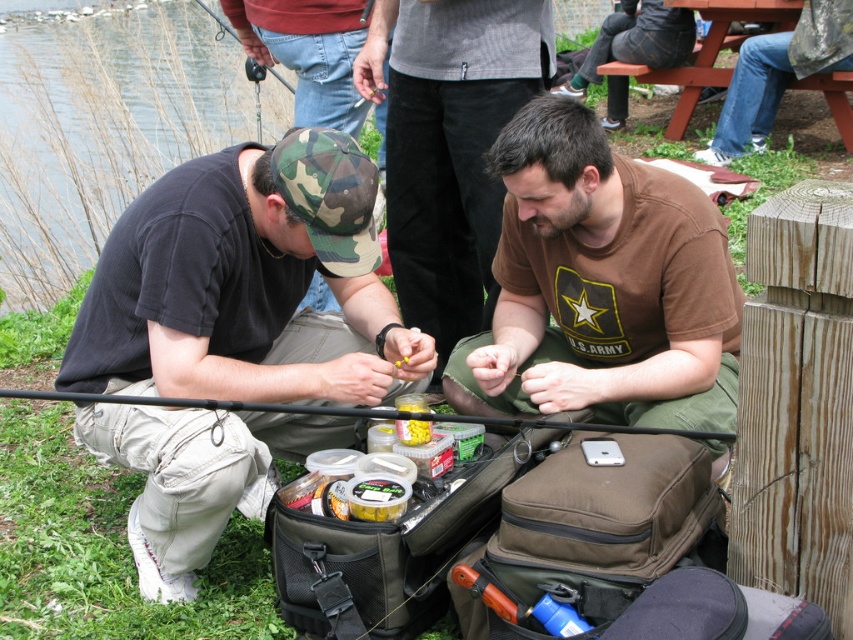
Between dark blue t-shirt at lower left and black matte fishing pole at center, which one is positioned lower?

black matte fishing pole at center is lower down.

Based on the photo, who is more forward, (131, 275) or (366, 416)?

Point (366, 416)

The width and height of the screenshot is (853, 640). Find the location of `dark blue t-shirt at lower left`. dark blue t-shirt at lower left is located at coordinates (247, 284).

What do you see at coordinates (360, 413) in the screenshot? I see `black matte fishing pole at center` at bounding box center [360, 413].

Who is more distant from viewer, (705, 433) or (428, 422)?

Point (428, 422)

Between point (524, 426) and point (430, 433), which one is positioned in front?

Point (524, 426) is in front.

Locate an element on the screen. The width and height of the screenshot is (853, 640). black matte fishing pole at center is located at coordinates (360, 413).

Does brown cotton shirt at center have a smaller size compared to black matte fishing pole at center?

No, brown cotton shirt at center is not smaller than black matte fishing pole at center.

Measure the distance between point (579,328) and camera.

8.14 feet

Identify the location of brown cotton shirt at center. (601, 285).